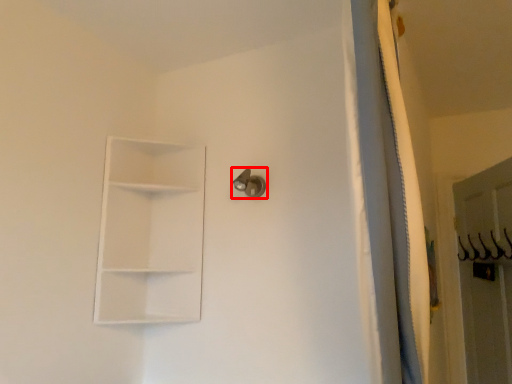
Question: Considering the relative positions of door handle (annotated by the red box) and shelf in the image provided, where is door handle (annotated by the red box) located with respect to the staircase?

Choices:
 (A) right
 (B) left

Answer: (A)